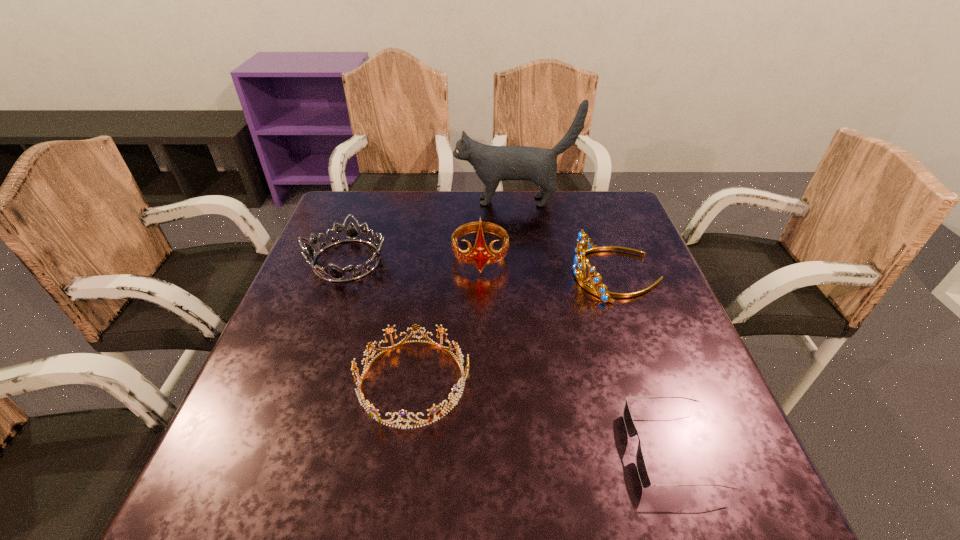
The width and height of the screenshot is (960, 540). I want to click on the farthest object, so click(x=492, y=164).

Locate an element on the screen. the tallest object is located at coordinates (492, 164).

At what (x,y) coordinates should I click in order to perform the action: click on the fifth shortest object. Please return your answer as a coordinate pair (x, y). Image resolution: width=960 pixels, height=540 pixels. Looking at the image, I should click on (480, 255).

Where is `the rightmost tiara`? the rightmost tiara is located at coordinates (583, 239).

At what (x,y) coordinates should I click in order to perform the action: click on the third shortest tiara. Please return your answer as a coordinate pair (x, y). Looking at the image, I should click on (583, 239).

Identify the location of the nearest tiara. This screenshot has height=540, width=960. (371, 409).

This screenshot has height=540, width=960. Identify the location of the shortest object. (631, 430).

What are the coordinates of `free space located 0.340m at the face of the tallest object` in the screenshot? It's located at (345, 201).

Where is `blank space located at the face of the tallest object`? The height and width of the screenshot is (540, 960). blank space located at the face of the tallest object is located at coordinates (425, 201).

Locate an element on the screen. The height and width of the screenshot is (540, 960). free space located at the face of the tallest object is located at coordinates (361, 201).